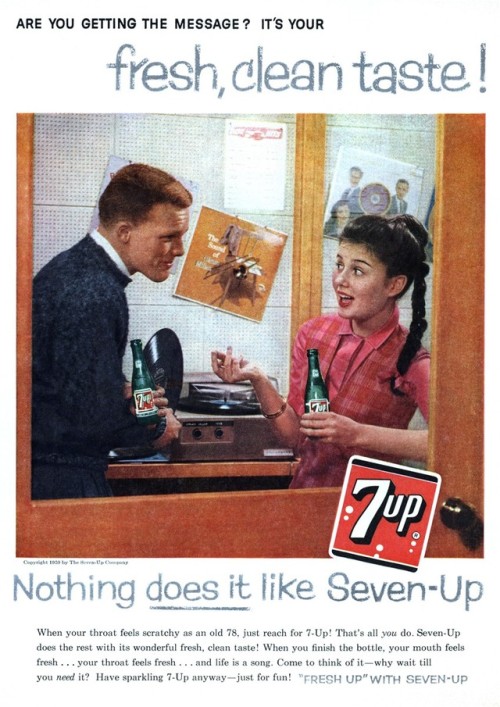
Locate an element on the screen. This screenshot has height=707, width=500. tuner knobs in black is located at coordinates (217, 432), (198, 432).